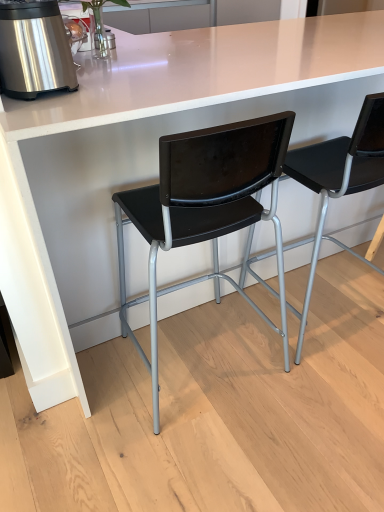
Question: From the image's perspective, would you say black plastic chair at center, which is counted as the 2th chair, starting from the right, is shown under stainless steel appliance at left?

Choices:
 (A) no
 (B) yes

Answer: (B)

Question: Can you confirm if black plastic chair at center, which is the first chair from left to right, is shorter than stainless steel appliance at left?

Choices:
 (A) yes
 (B) no

Answer: (B)

Question: Would you say black plastic chair at center, which is the first chair from left to right, is outside stainless steel appliance at left?

Choices:
 (A) yes
 (B) no

Answer: (A)

Question: Does black plastic chair at center, which is counted as the 2th chair, starting from the right, contain stainless steel appliance at left?

Choices:
 (A) yes
 (B) no

Answer: (B)

Question: Is black plastic chair at center, which is counted as the 2th chair, starting from the right, aimed at stainless steel appliance at left?

Choices:
 (A) no
 (B) yes

Answer: (A)

Question: Considering the positions of point pos(59,74) and point pos(370,115), is point pos(59,74) closer or farther from the camera than point pos(370,115)?

Choices:
 (A) closer
 (B) farther

Answer: (A)

Question: From the image's perspective, relative to black plastic chair at center, which appears as the first chair when viewed from the right, is stainless steel appliance at left above or below?

Choices:
 (A) below
 (B) above

Answer: (B)

Question: Would you say stainless steel appliance at left is inside or outside black plastic chair at center, which appears as the first chair when viewed from the right?

Choices:
 (A) inside
 (B) outside

Answer: (B)

Question: In terms of width, does stainless steel appliance at left look wider or thinner when compared to black plastic chair at center, positioned as the second chair in left-to-right order?

Choices:
 (A) wide
 (B) thin

Answer: (B)

Question: In terms of height, does black plastic chair at center, positioned as the second chair in left-to-right order, look taller or shorter compared to black plastic chair at center, which is counted as the 2th chair, starting from the right?

Choices:
 (A) short
 (B) tall

Answer: (B)

Question: Considering the positions of black plastic chair at center, positioned as the second chair in left-to-right order, and black plastic chair at center, which is the first chair from left to right, in the image, is black plastic chair at center, positioned as the second chair in left-to-right order, wider or thinner than black plastic chair at center, which is the first chair from left to right,?

Choices:
 (A) thin
 (B) wide

Answer: (A)

Question: From a real-world perspective, is black plastic chair at center, which appears as the first chair when viewed from the right, physically located above or below black plastic chair at center, which is the first chair from left to right?

Choices:
 (A) below
 (B) above

Answer: (A)

Question: Is point (380, 142) positioned closer to the camera than point (208, 137)?

Choices:
 (A) closer
 (B) farther

Answer: (B)

Question: From a real-world perspective, is black plastic chair at center, which is counted as the 2th chair, starting from the right, positioned above or below stainless steel appliance at left?

Choices:
 (A) below
 (B) above

Answer: (A)

Question: From their relative heights in the image, would you say black plastic chair at center, which is the first chair from left to right, is taller or shorter than stainless steel appliance at left?

Choices:
 (A) short
 (B) tall

Answer: (B)